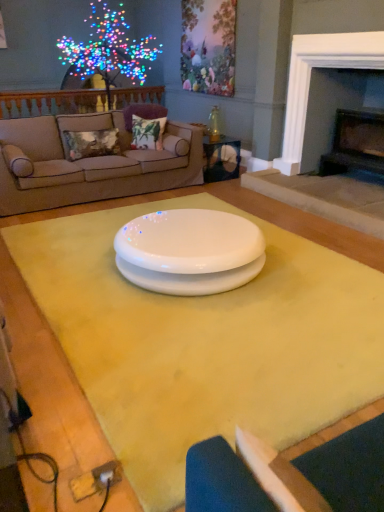
Question: In terms of width, does white fabric armchair at lower right look wider or thinner when compared to illuminated plastic tree at upper left?

Choices:
 (A) wide
 (B) thin

Answer: (B)

Question: From the image's perspective, is white fabric armchair at lower right positioned above or below illuminated plastic tree at upper left?

Choices:
 (A) above
 (B) below

Answer: (B)

Question: Based on their relative distances, which object is farther from the white glossy table at center, the 2th table from the bottom?

Choices:
 (A) yellow matte table at center, the second table from the back
 (B) white fabric armchair at lower right
 (C) black stone fireplace at right, which is counted as the 2th fireplace, starting from the left
 (D) beige fabric couch at upper left
 (E) illuminated plastic tree at upper left

Answer: (B)

Question: Which object is positioned closest to the floral fabric pillow at left, which ranks as the 1th pillow in left-to-right order?

Choices:
 (A) velvet floral pillow at upper left, the second pillow positioned from the left
 (B) white glossy table at center, positioned as the 2th table in front-to-back order
 (C) white fabric armchair at lower right
 (D) dark gray stone fireplace at upper right, arranged as the 1th fireplace when viewed from the left
 (E) yellow matte table at center, the 2th table positioned from the top

Answer: (A)